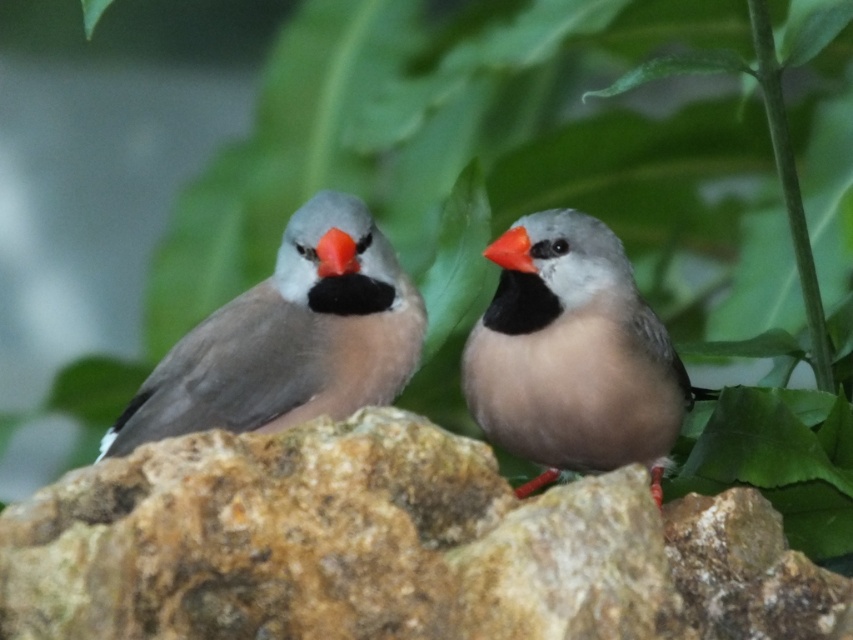
You are a birdwatcher observing two birds on a rock. You have a camera with a zoom lens that can focus on objects up to 30 cm wide. The matte gray bird at center and the gray matte bird at left are both in your view. Can your camera focus on both birds simultaneously?

The matte gray bird at center is less wide than the gray matte bird at left. Since the camera can focus on objects up to 30 cm wide, and the wider gray matte bird at left is within this limit, both birds can be focused on simultaneously as their widths are within the camera capability.

You are a birdwatcher observing the gray matte bird at left and the brown rough rock at center. Which object is wider?

The brown rough rock at center is wider than the gray matte bird at left.